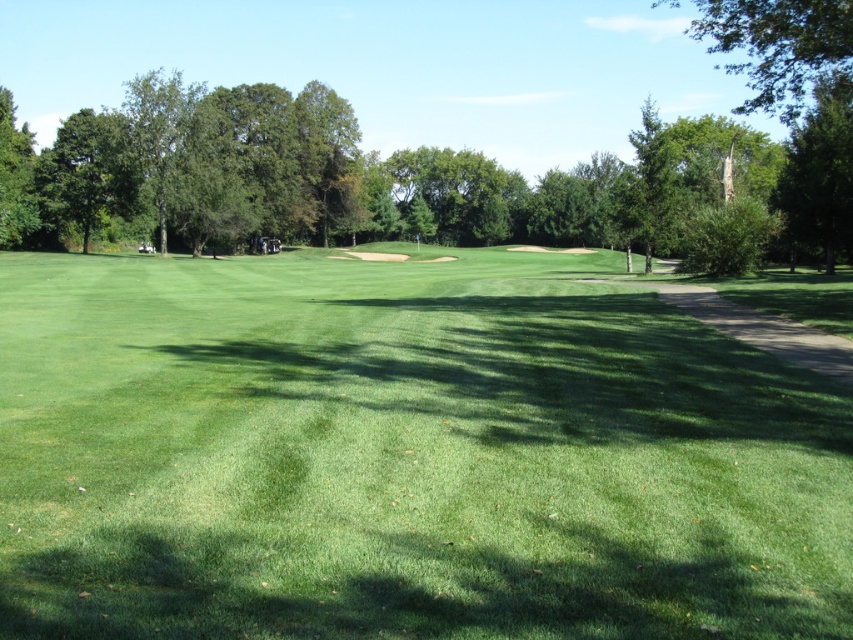
You are a golfer standing on the green grassy field at center. You want to hit a ball towards the green leafy tree at left. Which direction should you aim relative to your current position?

The green grassy field at center is to the right of the green leafy tree at left, so you should aim to the left to hit the ball towards the green leafy tree at left.

You are a golfer standing on the green grassy field at center. You want to hit a ball towards the green leafy tree at left. Will the ball roll towards the tree or away from it based on the slope of the field?

The green grassy field at center is in front of the green leafy tree at left, which means the field slopes downward towards the tree. Therefore, the ball will roll towards the tree.